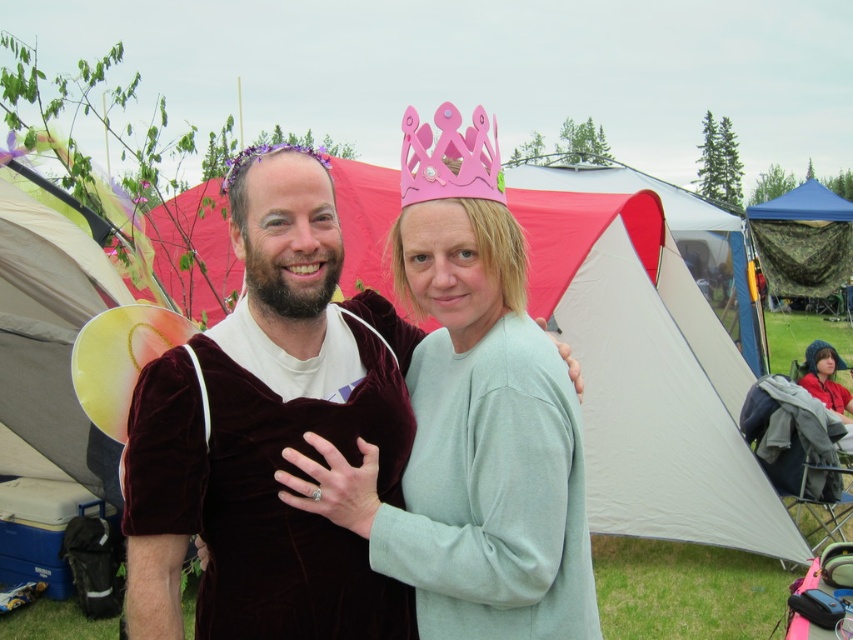
You are a photographer trying to capture a wide shot of the scene. The camera you are using has a maximum focus range of 20 meters. Can you focus on both the camouflage netting at right and the pink paper crown at upper center simultaneously?

The distance between the camouflage netting at right and the pink paper crown at upper center is 19.27 meters. Since the camera can focus up to 20 meters, both objects are within the focus range, so yes, you can focus on both.

You are standing at the point marked as point (842, 216) in the image. You want to throw a frisbee to a friend who is standing 20 meters away from you. Can you reach your friend with a single throw?

The distance between you and your friend is 19.10 meters, so yes, you can reach them with a single throw since it is less than 20 meters.

You are organizing a costume party and need to decide which item takes up more space horizontally. Based on the image, which object is wider between the velvet dress at center and the light blue fabric hat at lower right?

The velvet dress at center is wider than the light blue fabric hat at lower right according to the description.